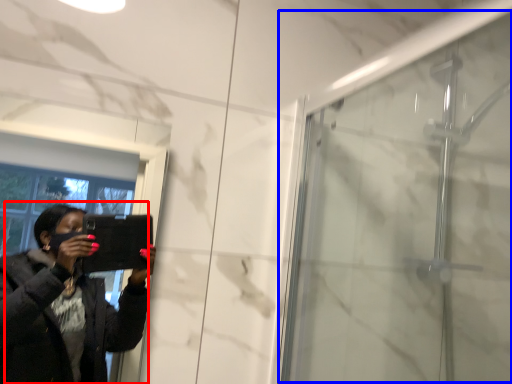
Question: Which of the following is the farthest to the observer, woman (highlighted by a red box) or screen door (highlighted by a blue box)?

Choices:
 (A) woman
 (B) screen door

Answer: (B)